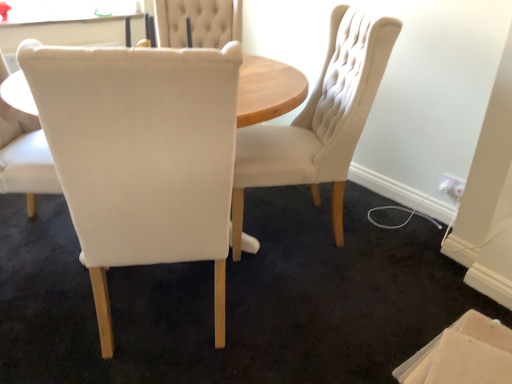
At what (x,y) coordinates should I click in order to perform the action: click on free point in front of matte cream chair at center, which appears as the third chair when viewed from the left. Please return your answer as a coordinate pair (x, y). This screenshot has height=384, width=512. Looking at the image, I should click on (316, 297).